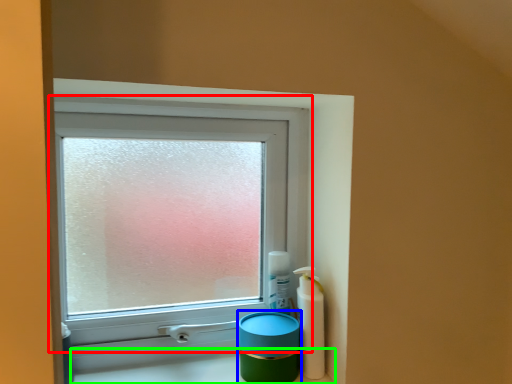
Question: Considering the real-world distances, which object is closest to window (highlighted by a red box)? teal (highlighted by a blue box) or counter top (highlighted by a green box).

Choices:
 (A) teal
 (B) counter top

Answer: (A)